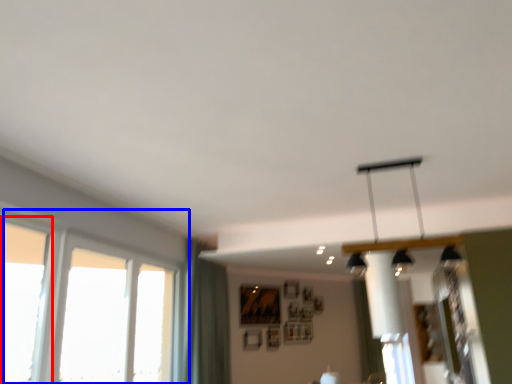
Question: Which of the following is the farthest to the observer, window (highlighted by a red box) or window (highlighted by a blue box)?

Choices:
 (A) window
 (B) window

Answer: (B)